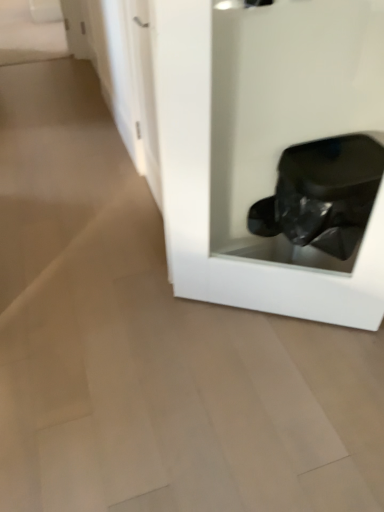
Question: From the image's perspective, is transparent glossy trash can at lower right under white glossy door at upper left?

Choices:
 (A) yes
 (B) no

Answer: (A)

Question: Considering the relative positions of transparent glossy trash can at lower right and white glossy door at upper left in the image provided, is transparent glossy trash can at lower right to the left of white glossy door at upper left from the viewer's perspective?

Choices:
 (A) yes
 (B) no

Answer: (B)

Question: Can you confirm if transparent glossy trash can at lower right is taller than white glossy door at upper left?

Choices:
 (A) no
 (B) yes

Answer: (B)

Question: Is transparent glossy trash can at lower right not near white glossy door at upper left?

Choices:
 (A) no
 (B) yes

Answer: (A)

Question: Is white glossy door at upper left at the back of transparent glossy trash can at lower right?

Choices:
 (A) yes
 (B) no

Answer: (B)

Question: Is transparent glossy trash can at lower right at the right side of white glossy door at upper left?

Choices:
 (A) yes
 (B) no

Answer: (A)

Question: Are white glossy door at upper left and transparent glossy trash can at lower right located far from each other?

Choices:
 (A) yes
 (B) no

Answer: (B)

Question: Can you confirm if white glossy door at upper left is bigger than transparent glossy trash can at lower right?

Choices:
 (A) yes
 (B) no

Answer: (B)

Question: Would you say white glossy door at upper left contains transparent glossy trash can at lower right?

Choices:
 (A) no
 (B) yes

Answer: (A)

Question: Is white glossy door at upper left further to the viewer compared to transparent glossy trash can at lower right?

Choices:
 (A) no
 (B) yes

Answer: (B)

Question: Is white glossy door at upper left completely or partially outside of transparent glossy trash can at lower right?

Choices:
 (A) yes
 (B) no

Answer: (A)

Question: Could you tell me if white glossy door at upper left is turned towards transparent glossy trash can at lower right?

Choices:
 (A) yes
 (B) no

Answer: (B)

Question: Is transparent glossy trash can at lower right in front of or behind white glossy door at upper left in the image?

Choices:
 (A) front
 (B) behind

Answer: (A)